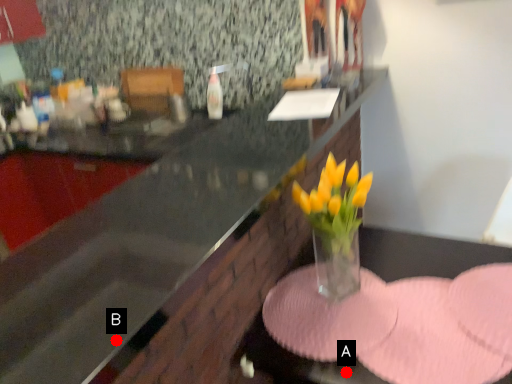
Question: Two points are circled on the image, labeled by A and B beside each circle. Which of the following is the farthest from the observer?

Choices:
 (A) A is further
 (B) B is further

Answer: (A)